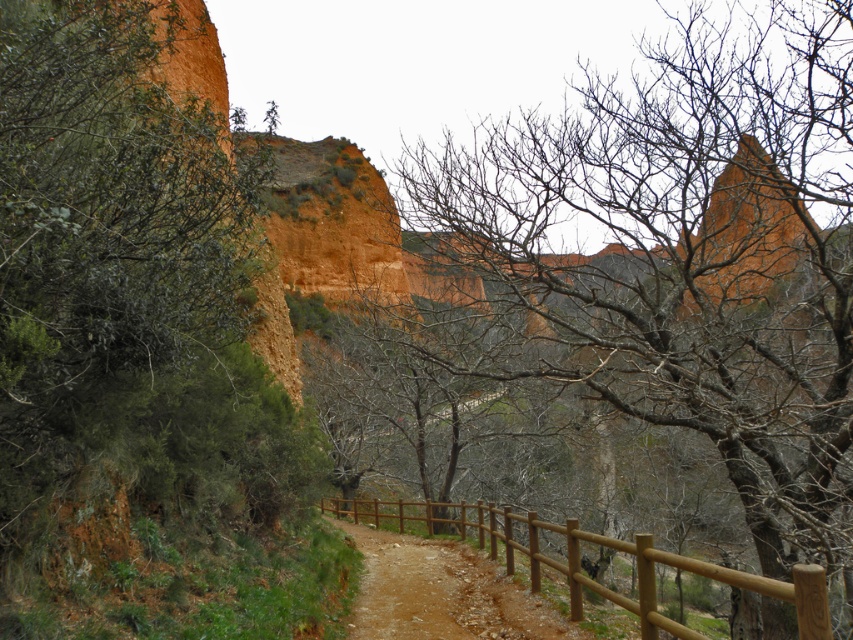
Question: Can you confirm if bare branches at center is thinner than brown wooden fence at lower center?

Choices:
 (A) no
 (B) yes

Answer: (A)

Question: Which object is closer to the camera taking this photo?

Choices:
 (A) bare branches at center
 (B) brown wooden fence at lower center

Answer: (B)

Question: Which object is closer to the camera taking this photo?

Choices:
 (A) brown wooden fence at lower center
 (B) bare branches at center

Answer: (A)

Question: Observing the image, what is the correct spatial positioning of bare branches at center in reference to brown wooden fence at lower center?

Choices:
 (A) below
 (B) above

Answer: (B)

Question: Does bare branches at center have a smaller size compared to brown wooden fence at lower center?

Choices:
 (A) no
 (B) yes

Answer: (A)